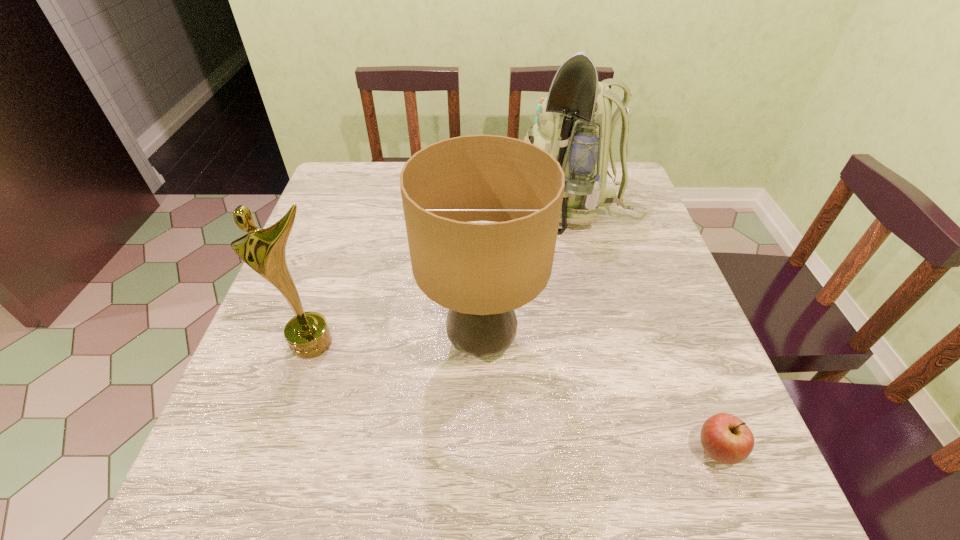
Where is `backpack`? backpack is located at coordinates (575, 125).

Locate an element on the screen. The image size is (960, 540). lampshade is located at coordinates (481, 272).

Find the location of a particular element. award is located at coordinates (307, 334).

The height and width of the screenshot is (540, 960). In order to click on the shortest object in this screenshot , I will do `click(725, 438)`.

At what (x,y) coordinates should I click in order to perform the action: click on the nearest object. Please return your answer as a coordinate pair (x, y). This screenshot has width=960, height=540. Looking at the image, I should click on click(725, 438).

Where is `vacant region located on the front-facing side of the farthest object`? The width and height of the screenshot is (960, 540). vacant region located on the front-facing side of the farthest object is located at coordinates (382, 207).

Where is `vacant space located on the front-facing side of the farthest object`? The image size is (960, 540). vacant space located on the front-facing side of the farthest object is located at coordinates (407, 207).

This screenshot has width=960, height=540. Identify the location of vacant region located on the front-facing side of the farthest object. (454, 207).

This screenshot has width=960, height=540. Find the location of `vacant space positioned 0.350m on the back of the lampshade`. vacant space positioned 0.350m on the back of the lampshade is located at coordinates (481, 206).

Locate an element on the screen. This screenshot has height=540, width=960. vacant area located 0.110m on the front-facing side of the award is located at coordinates (291, 411).